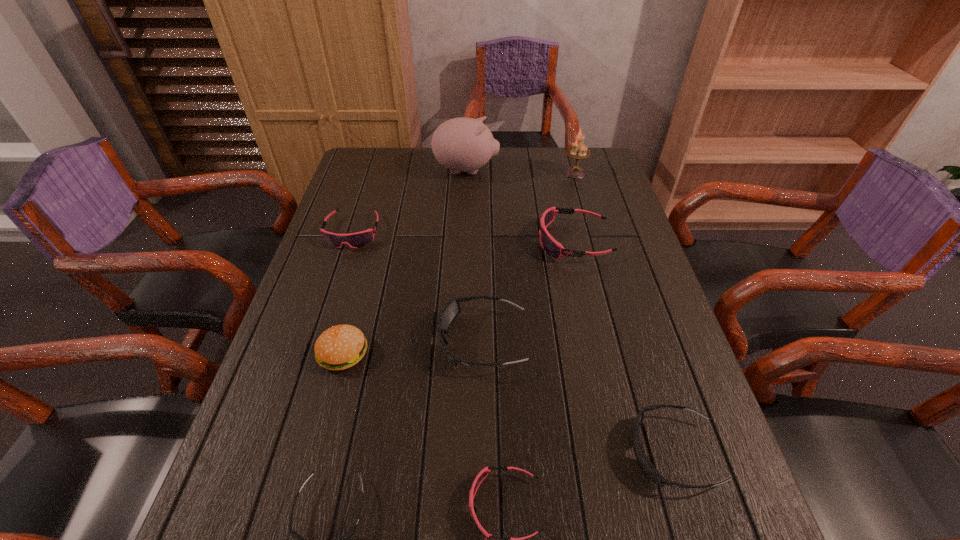
Locate an element on the screen. free space located on the front-facing side of the biggest pink goggles is located at coordinates (x=428, y=241).

At what (x,y) coordinates should I click in order to perform the action: click on vacant space positioned 0.210m on the front-facing side of the biggest pink goggles. Please return your answer as a coordinate pair (x, y). This screenshot has height=540, width=960. Looking at the image, I should click on (467, 241).

The height and width of the screenshot is (540, 960). What are the coordinates of `vacant space located 0.390m on the front-facing side of the biggest pink goggles` in the screenshot? It's located at [404, 241].

Find the location of a particular element. vacant area situated on the lenses of the second black goggles from left to right is located at coordinates (366, 341).

Where is `vacant region located 0.190m on the lenses of the second black goggles from left to right`? The height and width of the screenshot is (540, 960). vacant region located 0.190m on the lenses of the second black goggles from left to right is located at coordinates (357, 341).

The height and width of the screenshot is (540, 960). I want to click on blank space located on the lenses of the second black goggles from left to right, so 387,341.

Locate an element on the screen. This screenshot has height=540, width=960. vacant space situated 0.080m on the front of the brown patty is located at coordinates (328, 408).

The image size is (960, 540). What are the coordinates of `vacant space located on the front-facing side of the leftmost pink goggles` in the screenshot? It's located at (335, 286).

Find the location of a particular element. The height and width of the screenshot is (540, 960). free space located on the lenses of the second biggest black goggles is located at coordinates (546, 453).

This screenshot has height=540, width=960. Identify the location of vacant space located 0.320m on the lenses of the second biggest black goggles. (463, 453).